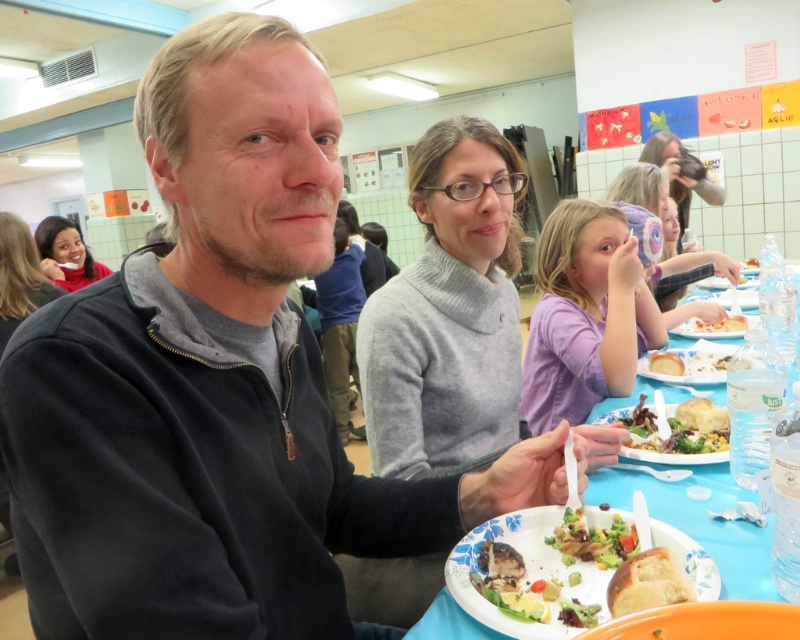
Where is `green leafy vegetables at center`? The height and width of the screenshot is (640, 800). green leafy vegetables at center is located at coordinates (674, 428).

Can you confirm if green leafy vegetables at center is positioned to the left of brown matte bread at lower center?

In fact, green leafy vegetables at center is to the right of brown matte bread at lower center.

Does point (646, 428) lie behind point (616, 588)?

That is True.

Locate an element on the screen. The width and height of the screenshot is (800, 640). green leafy vegetables at center is located at coordinates (674, 428).

Does smooth white cake at right appear on the left side of clear plastic water bottle at upper right?

Correct, you'll find smooth white cake at right to the left of clear plastic water bottle at upper right.

Can you confirm if smooth white cake at right is positioned to the right of clear plastic water bottle at upper right?

In fact, smooth white cake at right is to the left of clear plastic water bottle at upper right.

Measure the distance between smooth white cake at right and camera.

smooth white cake at right is 1.96 meters from camera.

At what (x,y) coordinates should I click in order to perform the action: click on smooth white cake at right. Please return your answer as a coordinate pair (x, y). The image size is (800, 640). Looking at the image, I should click on (718, 324).

Is point (614, 579) less distant than point (678, 355)?

Yes, it is in front of point (678, 355).

Is point (637, 570) farther from camera compared to point (676, 374)?

No, (637, 570) is in front of (676, 374).

This screenshot has width=800, height=640. What are the coordinates of `brown matte bread at lower center` in the screenshot? It's located at (648, 582).